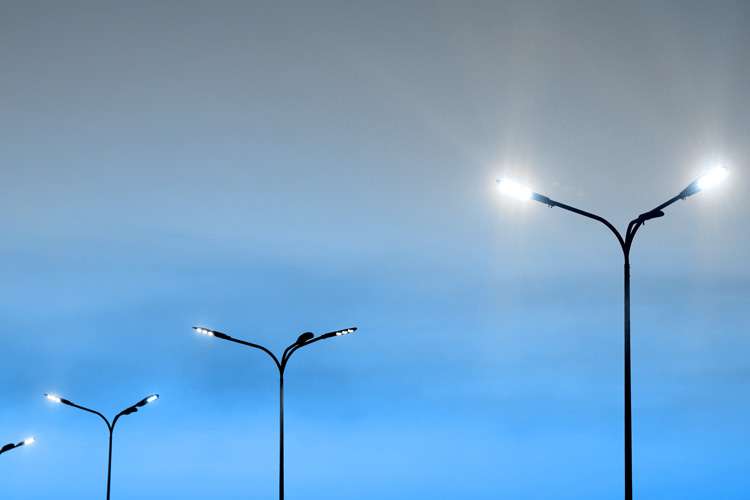
Identify the location of light. (49, 395).